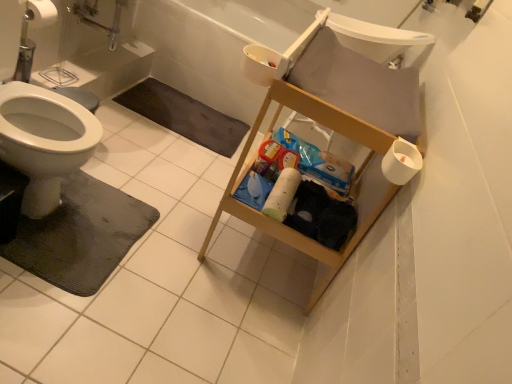
The image size is (512, 384). I want to click on vacant space in front of black rubber bath mat at lower left, acting as the 2th bath mat starting from the bottom, so click(160, 151).